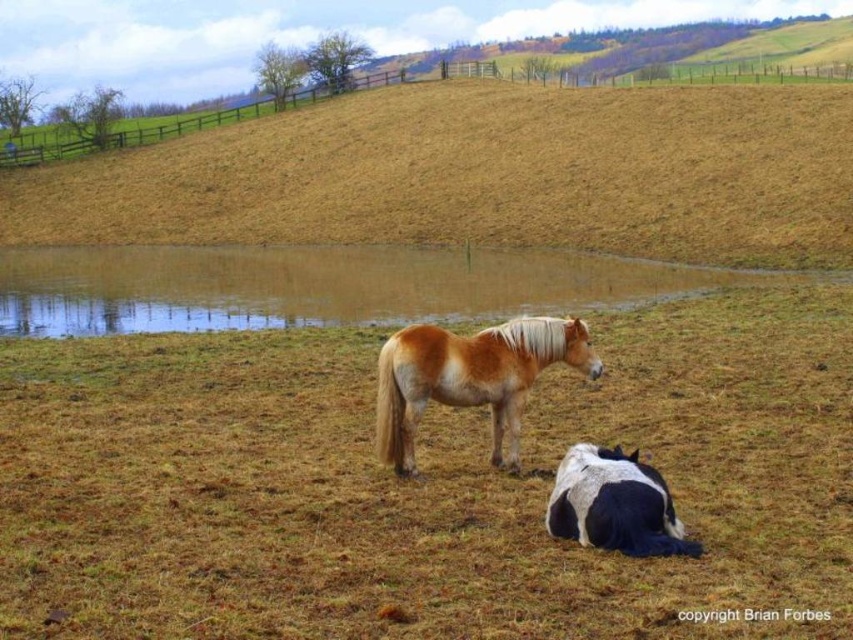
Question: Which of the following is the farthest from the observer?

Choices:
 (A) (97, 275)
 (B) (537, 211)
 (C) (599, 448)

Answer: (B)

Question: Estimate the real-world distances between objects in this image. Which object is farther from the black and white speckled horse at lower right?

Choices:
 (A) golden-brown mane horse at center
 (B) brown dry grass at center

Answer: (B)

Question: Is brown dry grass at center above golden-brown mane horse at center?

Choices:
 (A) no
 (B) yes

Answer: (A)

Question: Does brown grassy hillside at upper center lie behind black and white speckled horse at lower right?

Choices:
 (A) no
 (B) yes

Answer: (B)

Question: Which point is closer to the camera?

Choices:
 (A) golden-brown mane horse at center
 (B) brown dry grass at center
 (C) brown grassy hillside at upper center

Answer: (B)

Question: Can you confirm if brown dry grass at center is bigger than brown water at center?

Choices:
 (A) no
 (B) yes

Answer: (A)